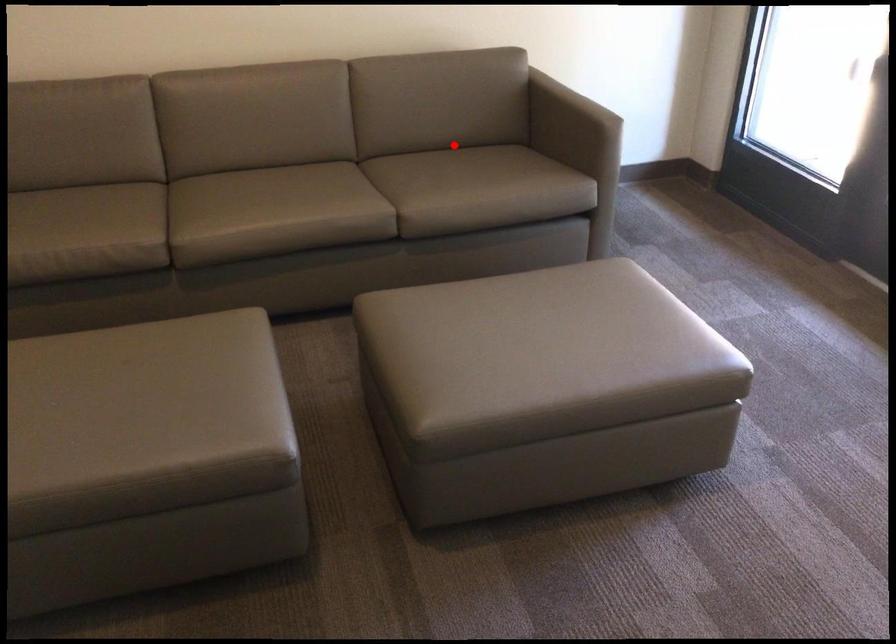
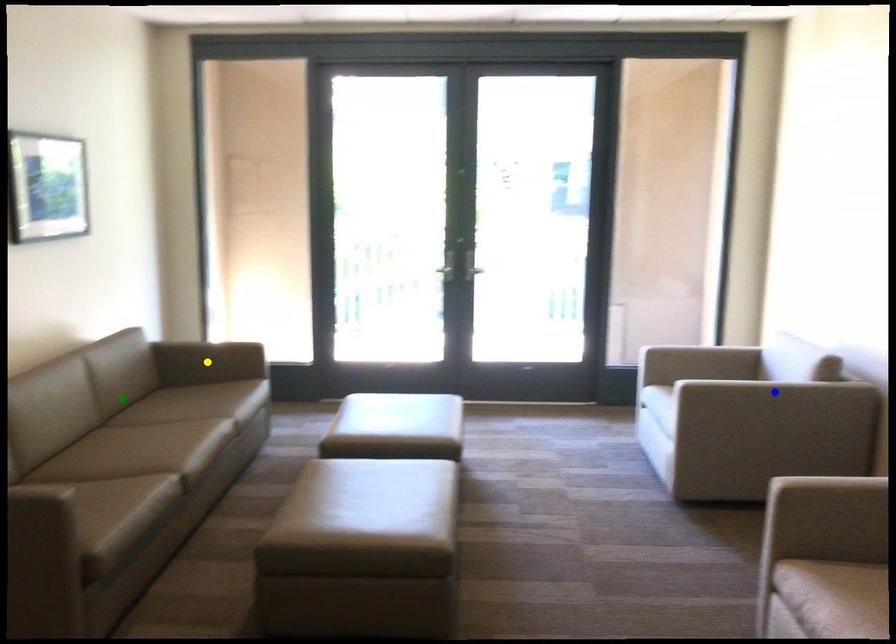
Question: I am providing you with two images of the same scene from different viewpoints. A red point is marked on the first image. You are given multiple points on the second image. Which point in image 2 represents the same 3d spot as the red point in image 1?

Choices:
 (A) blue point
 (B) green point
 (C) yellow point

Answer: (B)